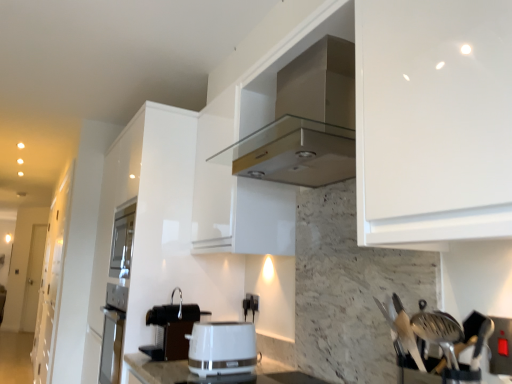
Question: From the image's perspective, is metallic silver utensils at right positioned above or below white glossy cabinet at left?

Choices:
 (A) above
 (B) below

Answer: (A)

Question: Is metallic silver utensils at right inside or outside of white glossy cabinet at left?

Choices:
 (A) outside
 (B) inside

Answer: (A)

Question: Which of these objects is positioned farthest from the black plastic coffee machine at lower center?

Choices:
 (A) metallic silver utensils at right
 (B) white glossy toaster at center
 (C) white glossy cabinet at left
 (D) black plastic electric outlet at center

Answer: (C)

Question: Which object is the farthest from the black plastic electric outlet at center?

Choices:
 (A) black plastic coffee machine at lower center
 (B) white glossy cabinet at left
 (C) white glossy toaster at center
 (D) metallic silver utensils at right

Answer: (B)